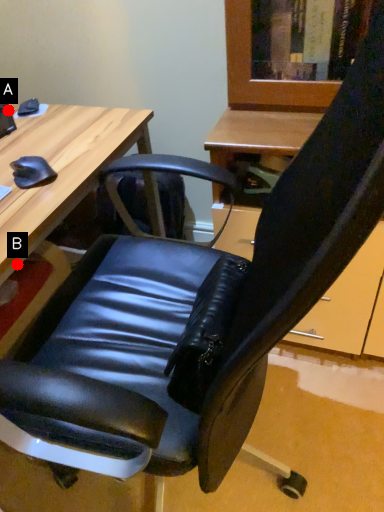
Question: Two points are circled on the image, labeled by A and B beside each circle. Among these points, which one is nearest to the camera?

Choices:
 (A) A is closer
 (B) B is closer

Answer: (B)